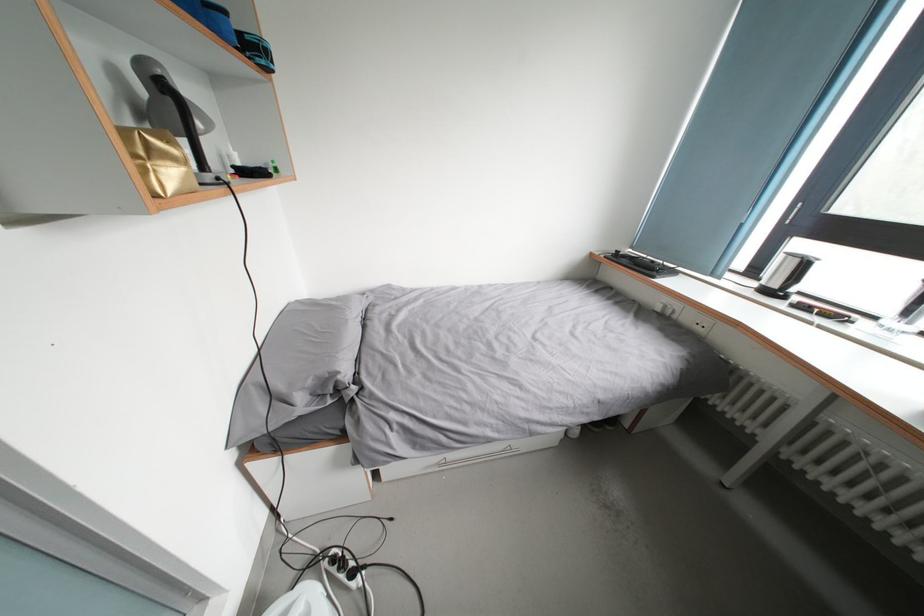
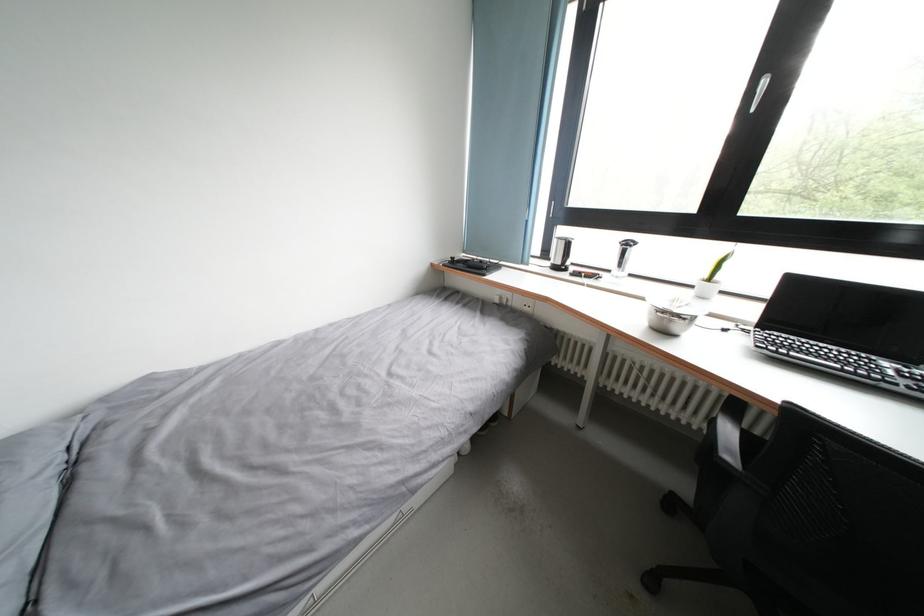
In the second image, find the point that corresponds to pixel 672 312 in the first image.

(507, 302)